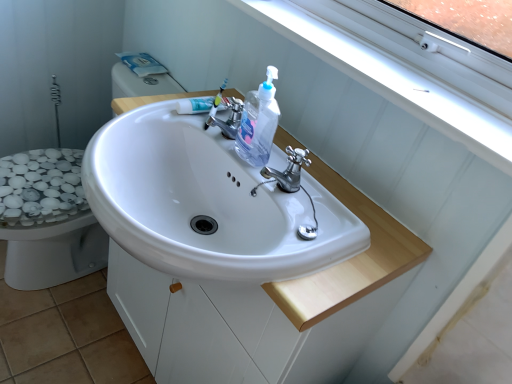
Where is `empty space that is ontop of white plastic window frame at upper right (from a real-world perspective)`? empty space that is ontop of white plastic window frame at upper right (from a real-world perspective) is located at coordinates (399, 74).